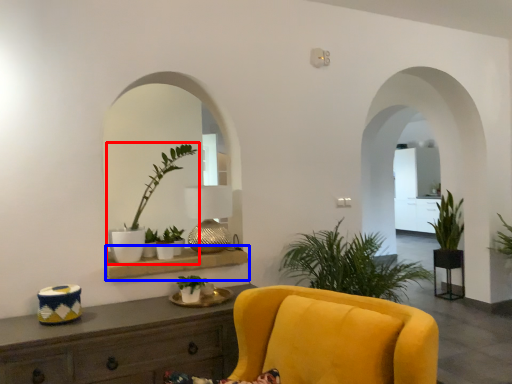
Question: Which object is further to the camera taking this photo, houseplant (highlighted by a red box) or shelf (highlighted by a blue box)?

Choices:
 (A) houseplant
 (B) shelf

Answer: (A)